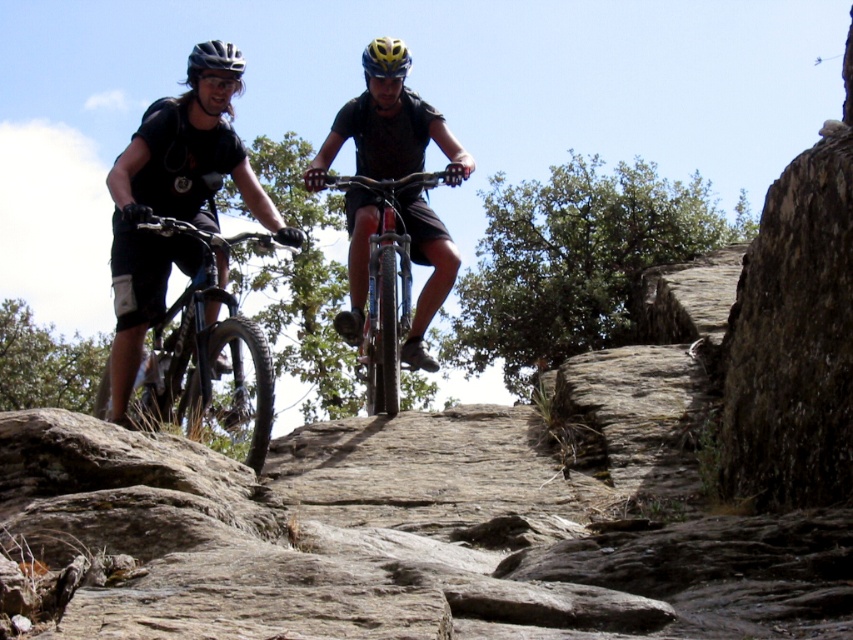
Question: Where is shiny metallic bicycle at center located in relation to matte black helmet at upper left in the image?

Choices:
 (A) right
 (B) left

Answer: (A)

Question: Is shiny black bike at left above shiny metallic bicycle at center?

Choices:
 (A) no
 (B) yes

Answer: (A)

Question: Which point is farther to the camera?

Choices:
 (A) matte black helmet at upper left
 (B) shiny metallic bicycle at center
 (C) shiny black bike at left

Answer: (B)

Question: Which point appears farthest from the camera in this image?

Choices:
 (A) (387, 323)
 (B) (207, 248)

Answer: (A)

Question: Is shiny black bike at left smaller than shiny metallic bicycle at center?

Choices:
 (A) no
 (B) yes

Answer: (A)

Question: Estimate the real-world distances between objects in this image. Which object is closer to the shiny metallic bicycle at center?

Choices:
 (A) matte black helmet at upper left
 (B) shiny black bike at left

Answer: (A)